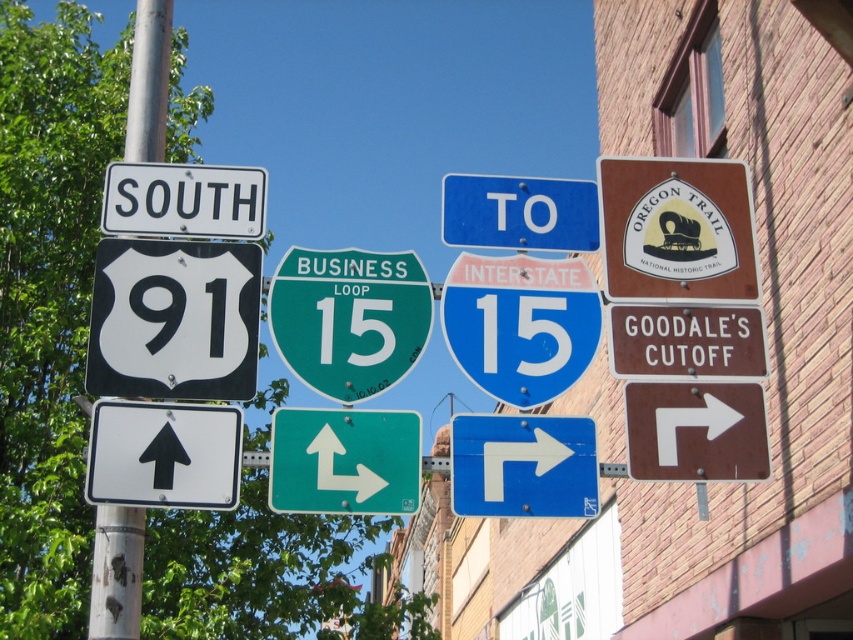
Which is above, blue glossy arrow at upper center or white plastic arrow at upper right?

white plastic arrow at upper right

Which is more to the right, blue glossy arrow at upper center or white plastic arrow at upper right?

white plastic arrow at upper right

You are a GUI agent. You are given a task and a screenshot of the screen. Output one action in this format:
    pyautogui.click(x=<x>, y=<y>)
    Task: Click on the blue glossy arrow at upper center
    
    Given the screenshot: What is the action you would take?
    pyautogui.click(x=523, y=465)

In the scene shown: Between green glossy business loop 15 sign at center and white plastic arrow at upper right, which one is positioned higher?

green glossy business loop 15 sign at center

Who is shorter, green glossy business loop 15 sign at center or white plastic arrow at upper right?

white plastic arrow at upper right

Who is more forward, [323,272] or [662,412]?

Positioned in front is point [662,412].

Locate an element on the screen. This screenshot has width=853, height=640. green glossy business loop 15 sign at center is located at coordinates (349, 317).

Is brown/metallic oregon trail sign at upper right above white plastic arrow at upper right?

Yes, brown/metallic oregon trail sign at upper right is above white plastic arrow at upper right.

Consider the image. Is the position of brown/metallic oregon trail sign at upper right less distant than that of white plastic arrow at upper right?

No, it is not.

Which is behind, point (692, 198) or point (718, 433)?

Point (692, 198)

The image size is (853, 640). What are the coordinates of `brown/metallic oregon trail sign at upper right` in the screenshot? It's located at [677, 228].